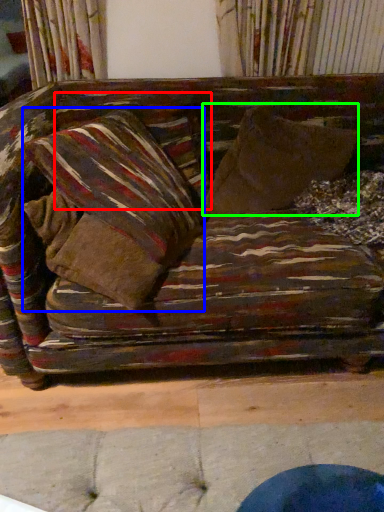
Question: Which is nearer to the pillow (highlighted by a red box)? pillow (highlighted by a blue box) or throw pillow (highlighted by a green box).

Choices:
 (A) pillow
 (B) throw pillow

Answer: (A)